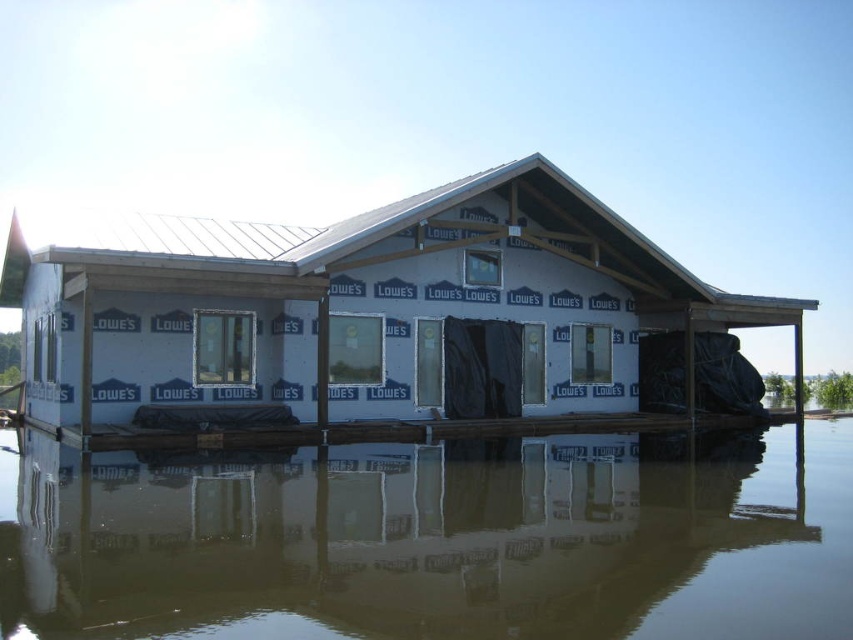
Question: In this image, where is brown murky water at lower center located relative to white foam dock at center?

Choices:
 (A) below
 (B) above

Answer: (A)

Question: Which point is farther to the camera?

Choices:
 (A) (540, 333)
 (B) (180, 556)

Answer: (A)

Question: Can you confirm if brown murky water at lower center is positioned to the right of white foam dock at center?

Choices:
 (A) yes
 (B) no

Answer: (B)

Question: Which object appears closest to the camera in this image?

Choices:
 (A) brown murky water at lower center
 (B) white foam dock at center

Answer: (A)

Question: Which object appears closest to the camera in this image?

Choices:
 (A) white foam dock at center
 (B) brown murky water at lower center

Answer: (B)

Question: Does brown murky water at lower center appear on the right side of white foam dock at center?

Choices:
 (A) yes
 (B) no

Answer: (B)